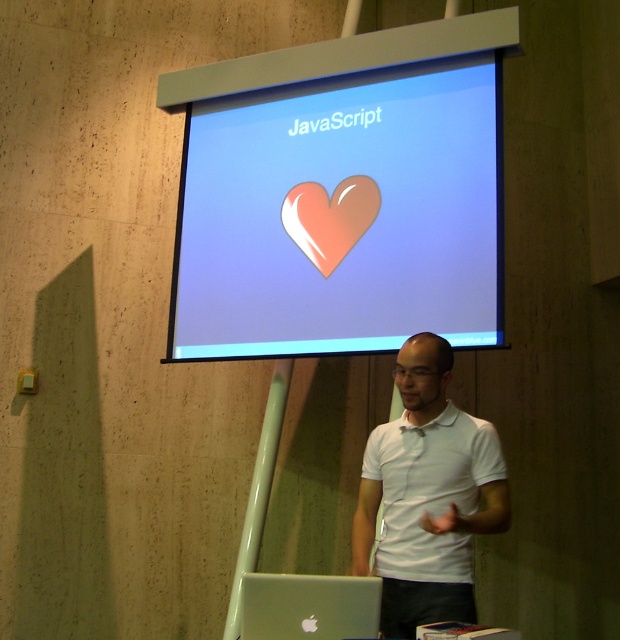
Based on the scene description, can you determine the exact coordinates of the white matte shirt at center?

The white matte shirt at center is located at coordinates point (427, 496).

You are an attendee at the presentation. You notice the matte plastic heart at upper center and the silver metallic laptop at lower center. Which object is positioned more to the right side of the screen?

The matte plastic heart at upper center is positioned more to the right side of the screen compared to the silver metallic laptop at lower center.